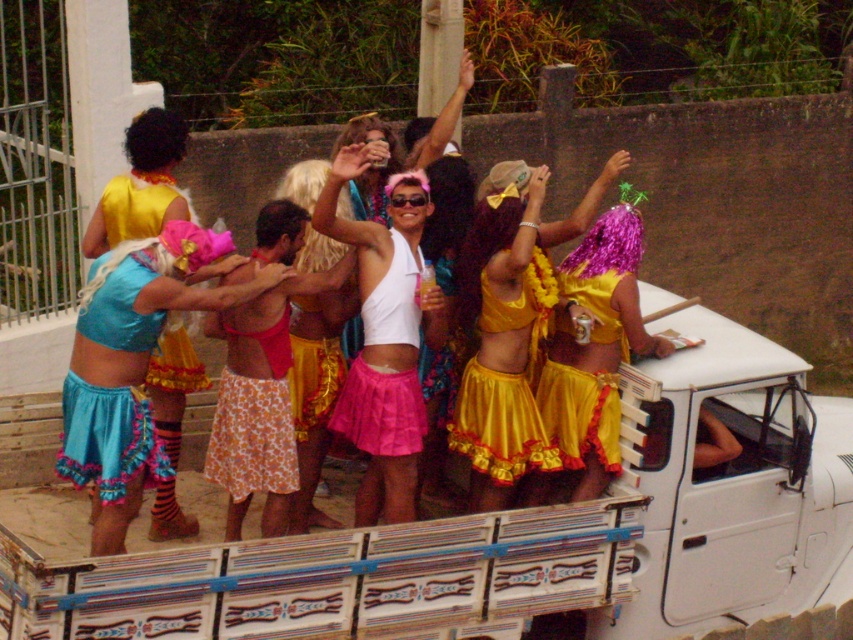
Consider the image. Is blue satin skirt at center positioned behind yellow satin dress at center?

No, it is not.

Who is lower down, blue satin skirt at center or yellow satin dress at center?

blue satin skirt at center

Image resolution: width=853 pixels, height=640 pixels. In order to click on blue satin skirt at center in this screenshot , I will do `click(134, 364)`.

Is blue satin skirt at center bigger than yellow satin skirt at center?

Indeed, blue satin skirt at center has a larger size compared to yellow satin skirt at center.

Identify the location of blue satin skirt at center. pos(134,364).

Between point (122, 252) and point (479, 353), which one is positioned behind?

The point (479, 353) is behind.

In order to click on blue satin skirt at center in this screenshot , I will do `click(134, 364)`.

Who is taller, yellow satin skirt at center or yellow satin dress at center?

Standing taller between the two is yellow satin skirt at center.

Based on the photo, between yellow satin skirt at center and yellow satin dress at center, which one has less height?

Standing shorter between the two is yellow satin dress at center.

Who is more distant from viewer, [463,388] or [614,310]?

The point [463,388] is more distant.

Where is `yellow satin skirt at center`? The height and width of the screenshot is (640, 853). yellow satin skirt at center is located at coordinates (506, 385).